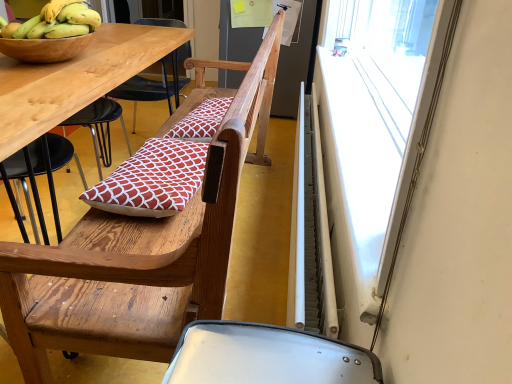
Question: From a real-world perspective, is white metallic radiator at right physically located above or below red printed fabric pillow at center, placed as the first pillow when sorted from top to bottom?

Choices:
 (A) above
 (B) below

Answer: (B)

Question: From the image's perspective, is white metallic radiator at right above or below red printed fabric pillow at center, marked as the second pillow in a bottom-to-top arrangement?

Choices:
 (A) above
 (B) below

Answer: (B)

Question: Which object is the farthest from the yellow bananas at upper left?

Choices:
 (A) wooden chair at center
 (B) red printed fabric pillow at center, marked as the second pillow in a bottom-to-top arrangement
 (C) red printed cushion at center, the 2th pillow from the top
 (D) white metallic radiator at right
 (E) white plastic window screen at upper right

Answer: (E)

Question: Which object is the farthest from the white plastic window screen at upper right?

Choices:
 (A) yellow bananas at upper left
 (B) red printed fabric pillow at center, which is the second pillow from front to back
 (C) wooden chair at center
 (D) red printed cushion at center, arranged as the second pillow when viewed from the back
 (E) white metallic radiator at right

Answer: (A)